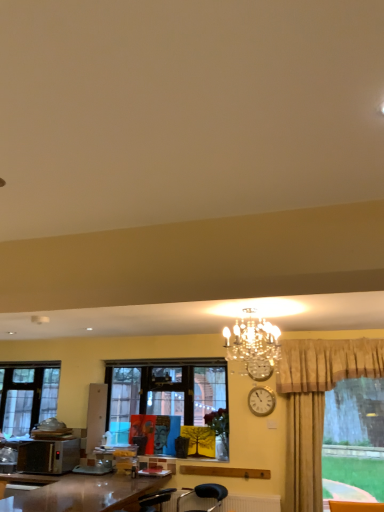
Measure the distance between metallic silver clock at upper center, which ranks as the 1th clock in top-to-bottom order, and camera.

metallic silver clock at upper center, which ranks as the 1th clock in top-to-bottom order, is 11.89 feet away from camera.

Find the location of `transparent glass window at center, which ranks as the 1th window in right-to-left order`. transparent glass window at center, which ranks as the 1th window in right-to-left order is located at coordinates (172, 400).

What do you see at coordinates (161, 433) in the screenshot? I see `matte blue painting at center` at bounding box center [161, 433].

Find the location of `silver metallic clock at upper center, which is the second clock in top-to-bottom order`. silver metallic clock at upper center, which is the second clock in top-to-bottom order is located at coordinates (261, 401).

Describe the element at coordinates (143, 431) in the screenshot. Image resolution: width=384 pixels, height=512 pixels. I see `matte wooden picture frame at center` at that location.

This screenshot has height=512, width=384. What do you see at coordinates (253, 341) in the screenshot? I see `crystal glass chandelier at upper center` at bounding box center [253, 341].

What do you see at coordinates (27, 395) in the screenshot? I see `clear glass window at left, the 2th window positioned from the right` at bounding box center [27, 395].

Locate an element on the screen. metallic silver clock at upper center, which is counted as the second clock, starting from the bottom is located at coordinates (259, 369).

From a real-world perspective, is metallic silver clock at upper center, which ranks as the 1th clock in top-to-bottom order, on crystal glass chandelier at upper center?

Incorrect, from a real-world perspective, metallic silver clock at upper center, which ranks as the 1th clock in top-to-bottom order, is lower than crystal glass chandelier at upper center.

Is metallic silver clock at upper center, which is counted as the second clock, starting from the bottom, positioned behind crystal glass chandelier at upper center?

Yes, the depth of metallic silver clock at upper center, which is counted as the second clock, starting from the bottom, is greater than that of crystal glass chandelier at upper center.

Where is `lamp that appears above the metallic silver clock at upper center, which is counted as the second clock, starting from the bottom (from a real-world perspective)`? lamp that appears above the metallic silver clock at upper center, which is counted as the second clock, starting from the bottom (from a real-world perspective) is located at coordinates (253, 341).

Is matte wooden picture frame at center next to clear glass window at left, the first window from the back, and touching it?

No, matte wooden picture frame at center is not touching clear glass window at left, the first window from the back.

Consider the image. Who is taller, matte wooden picture frame at center or clear glass window at left, the first window from the back?

clear glass window at left, the first window from the back, is taller.

Can you confirm if matte wooden picture frame at center is wider than clear glass window at left, acting as the second window starting from the front?

In fact, matte wooden picture frame at center might be narrower than clear glass window at left, acting as the second window starting from the front.

Is matte wooden picture frame at center positioned with its back to matte blue painting at center?

No, matte wooden picture frame at center's orientation is not away from matte blue painting at center.

Is point (145, 419) positioned before point (161, 431)?

No, it is not.

Considering the positions of objects matte wooden picture frame at center and matte blue painting at center in the image provided, who is more to the right, matte wooden picture frame at center or matte blue painting at center?

Positioned to the right is matte blue painting at center.

In terms of height, does matte wooden picture frame at center look taller or shorter compared to matte blue painting at center?

Clearly, matte wooden picture frame at center is taller compared to matte blue painting at center.

Does silver metallic clock at upper center, placed as the 1th clock when sorted from bottom to top, touch shiny brown desk at lower left?

No, silver metallic clock at upper center, placed as the 1th clock when sorted from bottom to top, is not beside shiny brown desk at lower left.

Does silver metallic clock at upper center, placed as the 1th clock when sorted from bottom to top, come behind shiny brown desk at lower left?

Yes, it is behind shiny brown desk at lower left.

Is shiny brown desk at lower left at the back of silver metallic clock at upper center, placed as the 1th clock when sorted from bottom to top?

silver metallic clock at upper center, placed as the 1th clock when sorted from bottom to top, does not have its back to shiny brown desk at lower left.

From a real-world perspective, is silver metallic clock at upper center, which is the second clock in top-to-bottom order, physically located above or below shiny brown desk at lower left?

Clearly, from a real-world perspective, silver metallic clock at upper center, which is the second clock in top-to-bottom order, is above shiny brown desk at lower left.

Which of these two, clear glass window at left, the first window from the left, or crystal glass chandelier at upper center, stands shorter?

crystal glass chandelier at upper center is shorter.

Looking at their sizes, would you say clear glass window at left, the first window from the back, is wider or thinner than crystal glass chandelier at upper center?

Considering their sizes, clear glass window at left, the first window from the back, looks slimmer than crystal glass chandelier at upper center.

Looking at this image, from the image's perspective, which one is positioned lower, clear glass window at left, the first window from the back, or crystal glass chandelier at upper center?

clear glass window at left, the first window from the back, from the image's perspective.

Considering the sizes of objects clear glass window at left, the first window from the left, and shiny brown desk at lower left in the image provided, who is wider, clear glass window at left, the first window from the left, or shiny brown desk at lower left?

shiny brown desk at lower left is wider.

From a real-world perspective, is clear glass window at left, acting as the second window starting from the front, positioned over shiny brown desk at lower left based on gravity?

Answer: Correct, in the physical world, clear glass window at left, acting as the second window starting from the front, is higher than shiny brown desk at lower left.

Is clear glass window at left, acting as the second window starting from the front, facing away from shiny brown desk at lower left?

No, clear glass window at left, acting as the second window starting from the front, is not facing away from shiny brown desk at lower left.

Between point (255, 362) and point (161, 418), which one is positioned behind?

Point (161, 418)

From the image's perspective, is metallic silver clock at upper center, which is counted as the second clock, starting from the bottom, located above or below matte blue painting at center?

metallic silver clock at upper center, which is counted as the second clock, starting from the bottom, is situated higher than matte blue painting at center in the image.

Which object is closer to the camera, metallic silver clock at upper center, which ranks as the 1th clock in top-to-bottom order, or matte blue painting at center?

metallic silver clock at upper center, which ranks as the 1th clock in top-to-bottom order, is more forward.

Are metallic silver clock at upper center, which ranks as the 1th clock in top-to-bottom order, and matte blue painting at center far apart?

That's right, there is a large distance between metallic silver clock at upper center, which ranks as the 1th clock in top-to-bottom order, and matte blue painting at center.

From the image's perspective, count 1st clocks downward from the crystal glass chandelier at upper center and point to it. Please provide its 2D coordinates.

[(259, 369)]

Locate an element on the screen. window behind the matte wooden picture frame at center is located at coordinates (27, 395).

From the image, which object appears to be nearer to silver metallic clock at upper center, which is the second clock in top-to-bottom order, transparent glass window at center, marked as the 2th window in a back-to-front arrangement, or metallic silver clock at upper center, which ranks as the 1th clock in top-to-bottom order?

Based on the image, metallic silver clock at upper center, which ranks as the 1th clock in top-to-bottom order, appears to be nearer to silver metallic clock at upper center, which is the second clock in top-to-bottom order.

Estimate the real-world distances between objects in this image. Which object is closer to matte wooden picture frame at center, metallic silver clock at upper center, which is counted as the second clock, starting from the bottom, or matte white cabinet at lower left?

Based on the image, matte white cabinet at lower left appears to be nearer to matte wooden picture frame at center.

When comparing their distances from metallic silver clock at upper center, which ranks as the 1th clock in top-to-bottom order, does clear glass window at left, the first window from the back, or silver metallic microwave oven at lower left seem further?

The object further to metallic silver clock at upper center, which ranks as the 1th clock in top-to-bottom order, is clear glass window at left, the first window from the back.

Which object lies further to the anchor point transparent glass window at center, placed as the first window when sorted from front to back, clear glass window at left, acting as the second window starting from the front, or matte blue painting at center?

Based on the image, clear glass window at left, acting as the second window starting from the front, appears to be further to transparent glass window at center, placed as the first window when sorted from front to back.

From the image, which object appears to be farther from matte white cabinet at lower left, silver metallic clock at upper center, placed as the 1th clock when sorted from bottom to top, or matte wooden picture frame at center?

silver metallic clock at upper center, placed as the 1th clock when sorted from bottom to top.

Based on their spatial positions, is silver metallic clock at upper center, which is the second clock in top-to-bottom order, or transparent glass window at center, marked as the 2th window in a back-to-front arrangement, further from metallic silver clock at upper center, which ranks as the 1th clock in top-to-bottom order?

transparent glass window at center, marked as the 2th window in a back-to-front arrangement, is positioned further to the anchor metallic silver clock at upper center, which ranks as the 1th clock in top-to-bottom order.

When comparing their distances from shiny brown desk at lower left, does matte blue painting at center or crystal glass chandelier at upper center seem closer?

matte blue painting at center.

Considering their positions, is metallic silver clock at upper center, which ranks as the 1th clock in top-to-bottom order, positioned closer to transparent glass window at center, placed as the first window when sorted from front to back, than matte white cabinet at lower left?

matte white cabinet at lower left is closer to transparent glass window at center, placed as the first window when sorted from front to back.

The width and height of the screenshot is (384, 512). Identify the location of window between crystal glass chandelier at upper center and matte blue painting at center from front to back. (172, 400).

This screenshot has width=384, height=512. In order to click on microwave oven between shiny brown desk at lower left and matte wooden picture frame at center from front to back in this screenshot , I will do `click(48, 456)`.

Find the location of `window located between silver metallic microwave oven at lower left and metallic silver clock at upper center, which is counted as the second clock, starting from the bottom, in the left-right direction`. window located between silver metallic microwave oven at lower left and metallic silver clock at upper center, which is counted as the second clock, starting from the bottom, in the left-right direction is located at coordinates (172, 400).

This screenshot has width=384, height=512. I want to click on desk located between silver metallic microwave oven at lower left and silver metallic clock at upper center, which is the second clock in top-to-bottom order, in the left-right direction, so click(83, 494).